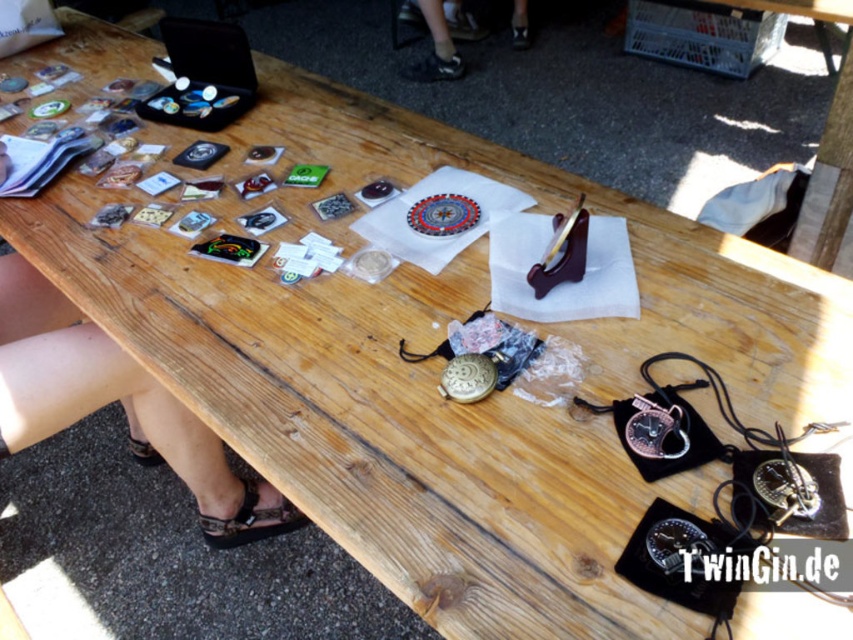
Is polished silver pocket watch at lower right wider than gold metallic pocket watch at center?

Yes.

Who is more forward, (636, 422) or (459, 355)?

Point (636, 422) is more forward.

Locate an element on the screen. The width and height of the screenshot is (853, 640). polished silver pocket watch at lower right is located at coordinates (654, 429).